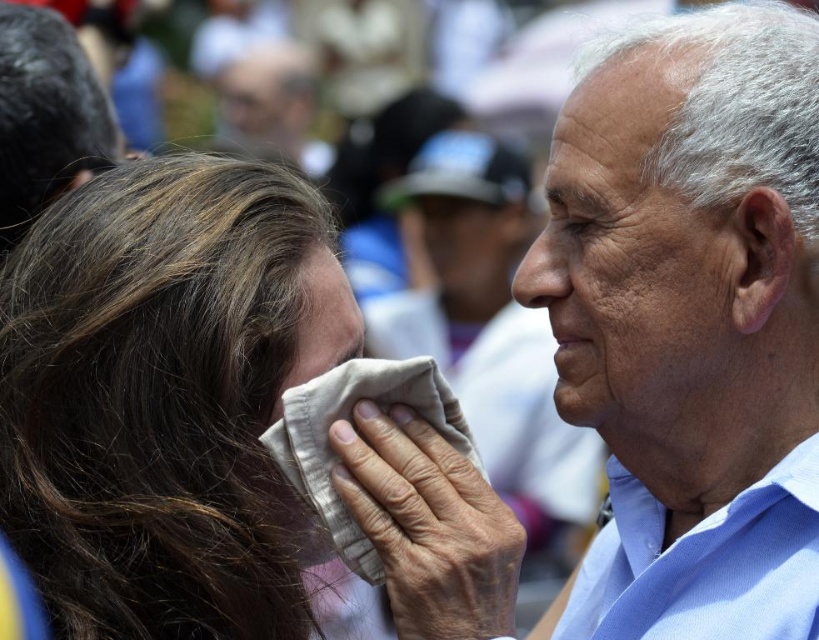
Measure the distance between point (581, 282) and camera.

7.12 feet

In the scene shown: Is light blue shirt at center taller than dark brown hair at left?

Yes.

You are a GUI agent. You are given a task and a screenshot of the screen. Output one action in this format:
    pyautogui.click(x=<x>, y=<y>)
    Task: Click on the light blue shirt at center
    Image resolution: width=819 pixels, height=640 pixels.
    Given the screenshot: What is the action you would take?
    pyautogui.click(x=691, y=324)

Is smooth skin face at right closer to camera compared to smooth beige cloth at center?

No, smooth skin face at right is further to the viewer.

Is point (681, 368) positioned behind point (338, 339)?

Yes, point (681, 368) is farther from viewer.

You are a GUI agent. You are given a task and a screenshot of the screen. Output one action in this format:
    pyautogui.click(x=<x>, y=<y>)
    Task: Click on the smooth skin face at right
    This screenshot has width=819, height=640.
    Given the screenshot: What is the action you would take?
    pyautogui.click(x=631, y=262)

Identify the location of dark brown hair at left. This screenshot has height=640, width=819. (164, 397).

Which is above, dark brown hair at left or smooth skin face at right?

smooth skin face at right is higher up.

Between point (102, 260) and point (637, 412), which one is positioned behind?

Point (637, 412)

You are a GUI agent. You are given a task and a screenshot of the screen. Output one action in this format:
    pyautogui.click(x=<x>, y=<y>)
    Task: Click on the dark brown hair at left
    
    Given the screenshot: What is the action you would take?
    (164, 397)